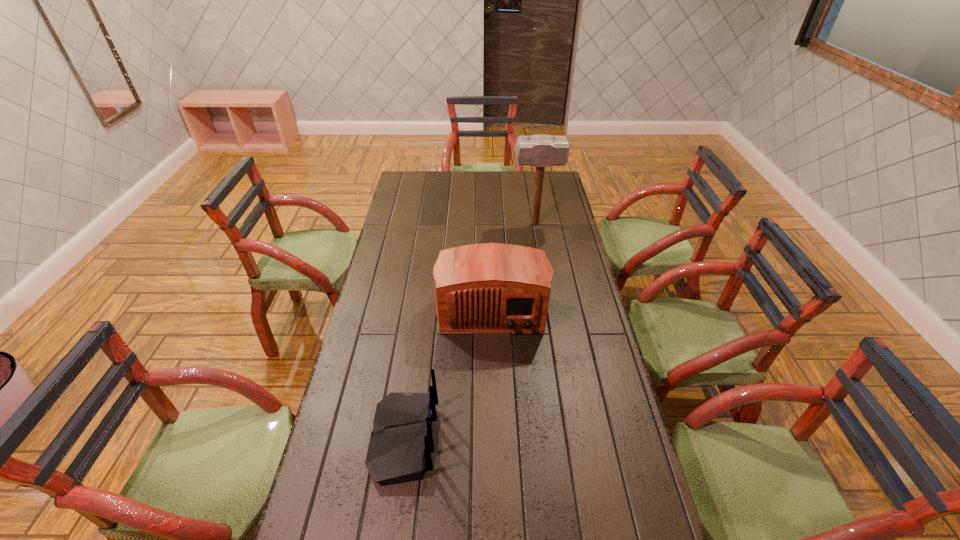
You are a GUI agent. You are given a task and a screenshot of the screen. Output one action in this format:
    pyautogui.click(x=<x>, y=<y>)
    Task: Click on the tallest object
    
    Given the screenshot: What is the action you would take?
    pyautogui.click(x=541, y=150)

At what (x,y) coordinates should I click in order to perform the action: click on mallet. Please return your answer as a coordinate pair (x, y). Looking at the image, I should click on (541, 150).

At what (x,y) coordinates should I click in order to perform the action: click on the second nearest object. Please return your answer as a coordinate pair (x, y). Looking at the image, I should click on (491, 287).

You are a GUI agent. You are given a task and a screenshot of the screen. Output one action in this format:
    pyautogui.click(x=<x>, y=<y>)
    Task: Click on the radio receiver
    
    Given the screenshot: What is the action you would take?
    pyautogui.click(x=491, y=287)

Find the location of a particular element. the shortest object is located at coordinates (399, 450).

Image resolution: width=960 pixels, height=540 pixels. I want to click on router, so click(399, 450).

The image size is (960, 540). Identify the location of vacant region located 0.230m on the striking face of the mallet. (462, 224).

Locate an element on the screen. The image size is (960, 540). vacant space located 0.390m on the striking face of the mallet is located at coordinates tap(427, 224).

Where is `vacant space situated on the striking face of the mallet`? The width and height of the screenshot is (960, 540). vacant space situated on the striking face of the mallet is located at coordinates (486, 224).

Identify the location of vacant area located on the front-facing side of the second nearest object. (492, 355).